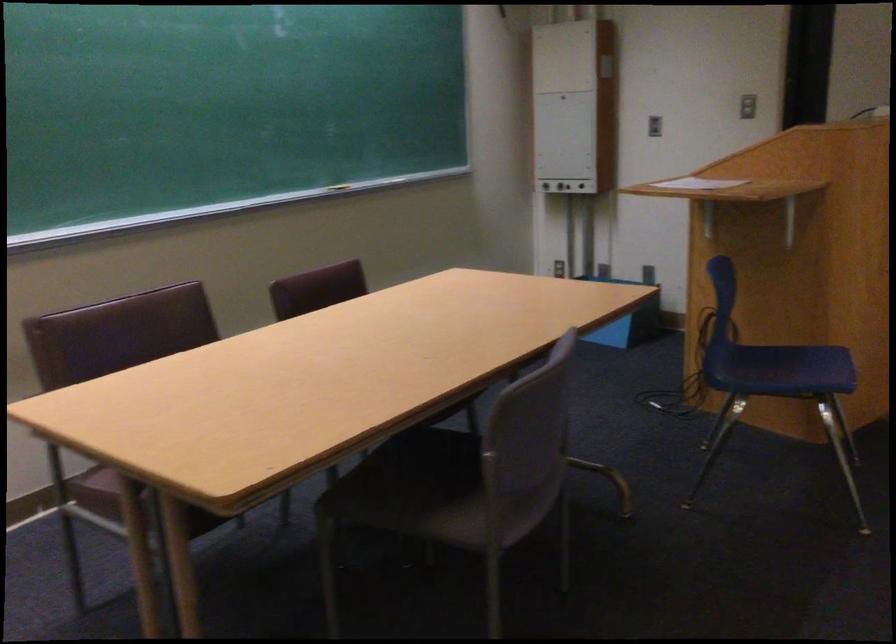
Which object does [698,184] point to?

It corresponds to the white paper in the image.